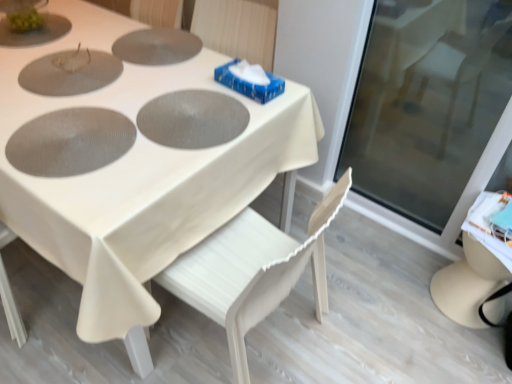
Locate an element on the screen. The image size is (512, 384). vacant space underneath gray matte pizza pan at center, which is the second pizza pan in back-to-front order (from a real-world perspective) is located at coordinates (181, 106).